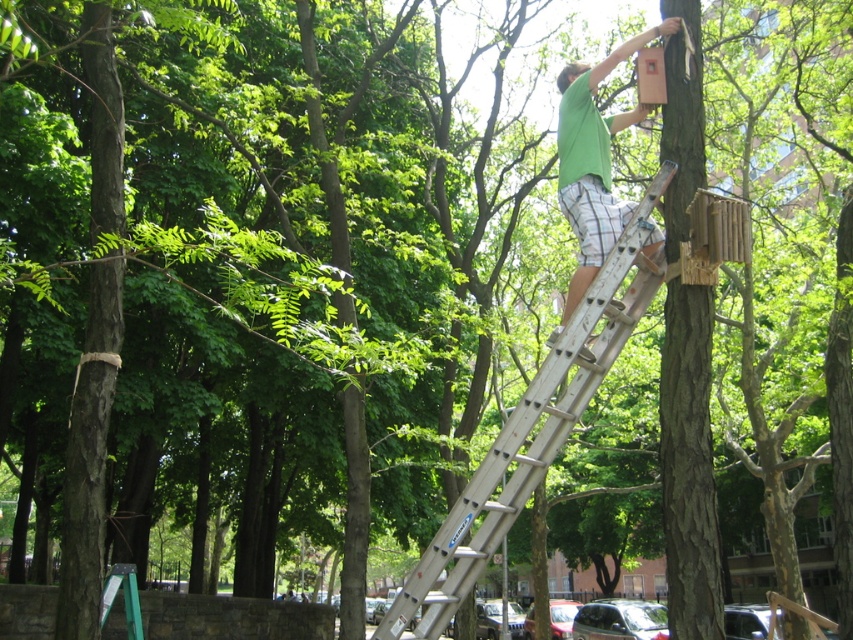
You are a park visitor who wants to take a photo of the white metallic ladder at upper center and the green matte shirt at upper right. Since the ladder is shorter than the green matte shirt, where should you position yourself to ensure both objects are fully visible in the frame?

To capture both the white metallic ladder at upper center and the green matte shirt at upper right in the frame, position yourself at a lower angle so that the taller green matte shirt at upper right doesn